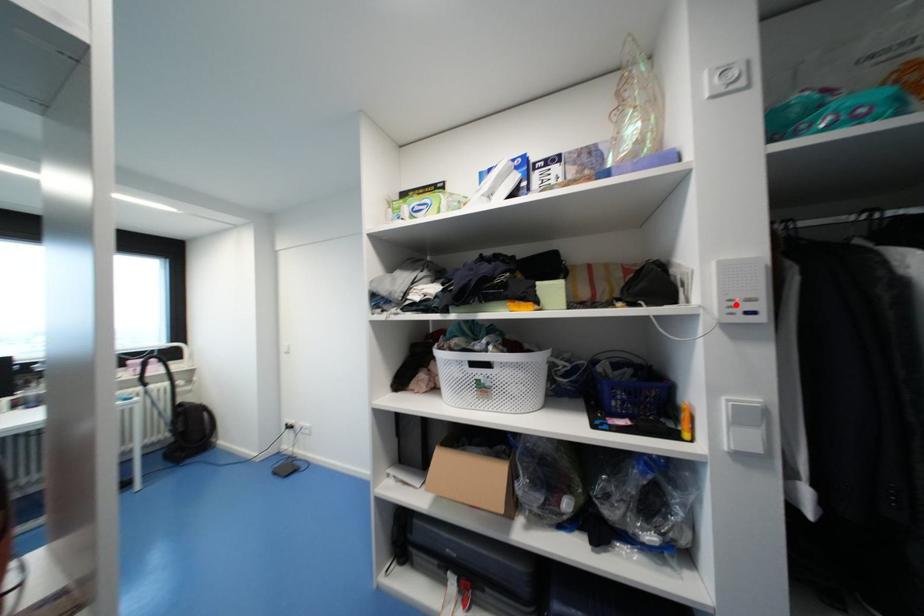
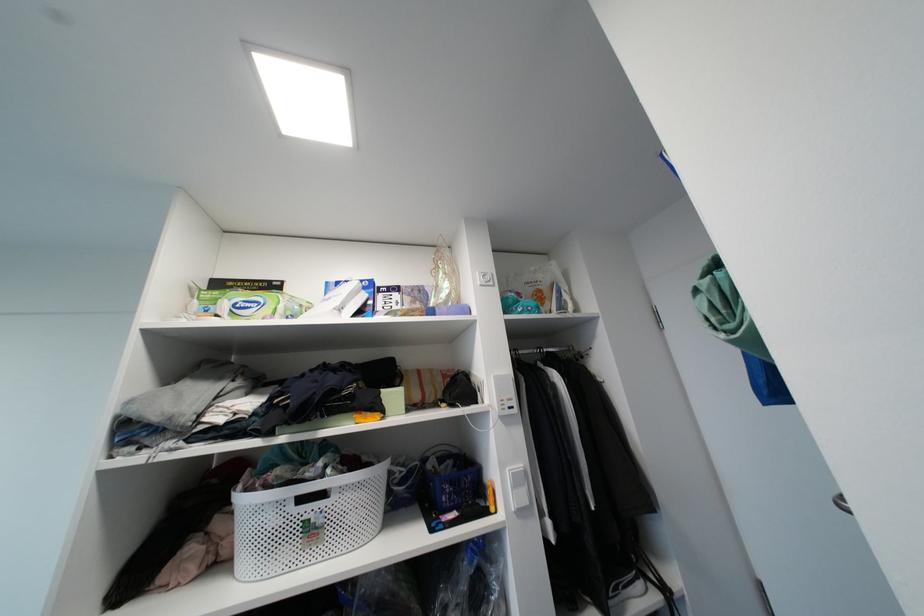
The point at the highlighted location is marked in the first image. Where is the corresponding point in the second image?

(506, 403)